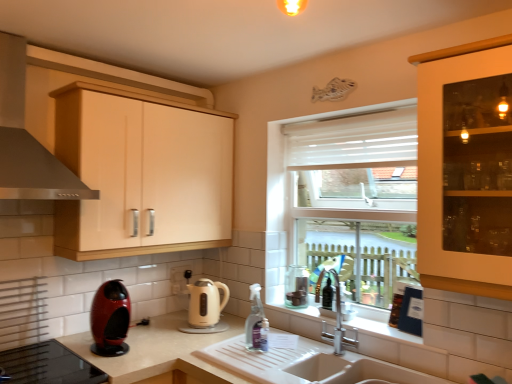
You are a GUI agent. You are given a task and a screenshot of the screen. Output one action in this format:
    pyautogui.click(x=<x>, y=<y>)
    Task: Click on the free spot above satin silver exhaust hood at upper left (from a real-world perspective)
    This screenshot has height=384, width=512.
    Given the screenshot: What is the action you would take?
    pyautogui.click(x=42, y=19)